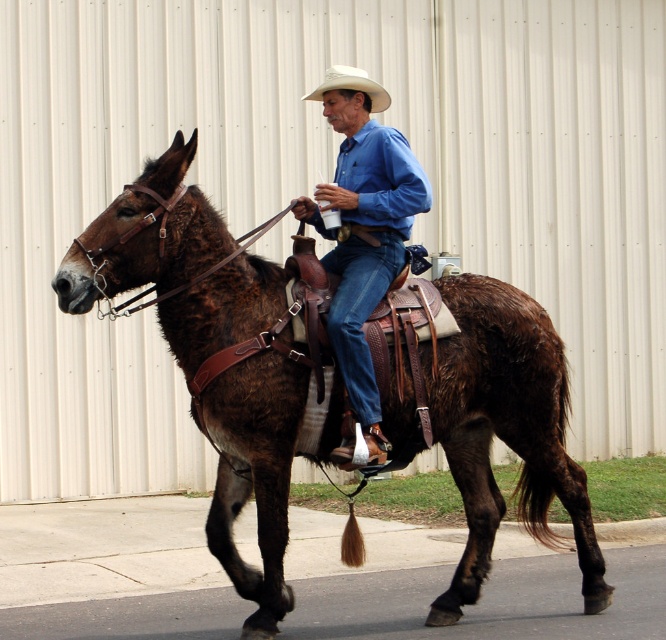
You are a photographer trying to capture a clear shot of the brown leather horse at center and the white matte cowboy hat at center. Which object should you focus on first to ensure both are in focus?

The brown leather horse at center is closer to the viewer than the white matte cowboy hat at center. To ensure both are in focus, focus on the brown leather horse at center first since it is closer, and the depth of field will likely cover the farther object.

You are a photographer trying to capture the man in the scene. To ensure both the blue denim jeans at center and the white matte cowboy hat at center are visible in your shot, which direction should you adjust your camera? Explain your reasoning based on their positions.

The blue denim jeans at center are to the right of the white matte cowboy hat at center. To include both in the frame, you should adjust the camera to the left to ensure the jeans on the right and the hat on the left are both visible.

You are a photographer trying to capture a photo of the man and the donkey. You notice two specific points in the scene labeled as point 1 at coordinates point [107,234] and point 2 at coordinates point [350,106]. Based on their positions, which point would appear larger in your photo?

Point 1 at coordinates point [107,234] would appear larger in the photo because it is closer to the camera than point 2 at coordinates point [350,106].